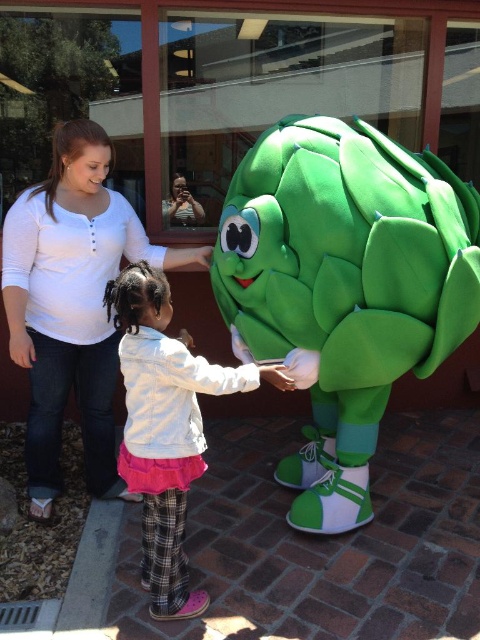
Question: Considering the relative positions of white matte shirt at upper left and white fleece jacket at center in the image provided, where is white matte shirt at upper left located with respect to white fleece jacket at center?

Choices:
 (A) left
 (B) right

Answer: (A)

Question: Estimate the real-world distances between objects in this image. Which object is farther from the white matte shirt at upper left?

Choices:
 (A) white fleece jacket at center
 (B) green plush artichoke at center

Answer: (B)

Question: Does green plush artichoke at center have a lesser width compared to white matte shirt at upper left?

Choices:
 (A) no
 (B) yes

Answer: (A)

Question: Can you confirm if green plush artichoke at center is bigger than white fleece jacket at center?

Choices:
 (A) no
 (B) yes

Answer: (B)

Question: Estimate the real-world distances between objects in this image. Which object is closer to the white matte shirt at upper left?

Choices:
 (A) green plush artichoke at center
 (B) white fleece jacket at center

Answer: (B)

Question: Which object is farther from the camera taking this photo?

Choices:
 (A) white matte shirt at upper left
 (B) white fleece jacket at center

Answer: (A)